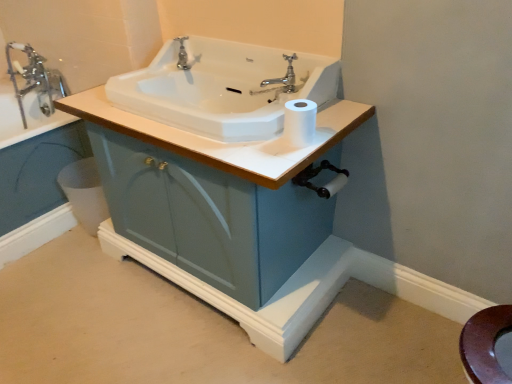
At what (x,y) coordinates should I click in order to perform the action: click on free space to the left of white matte toilet paper at upper center. Please return your answer as a coordinate pair (x, y). Looking at the image, I should click on (243, 141).